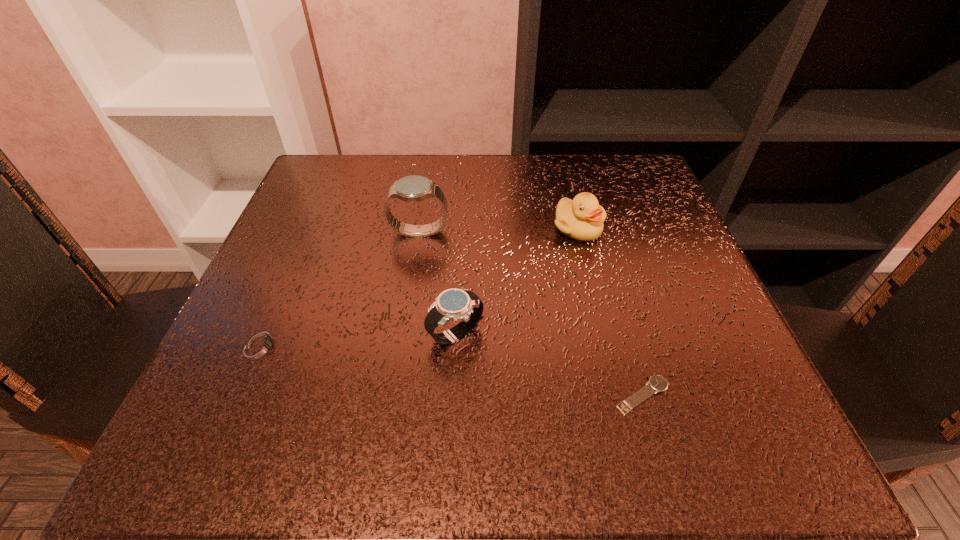
Locate an element on the screen. vacant space that's between the third shortest watch and the nearest object is located at coordinates (549, 364).

This screenshot has width=960, height=540. In order to click on free space between the second tallest watch and the duckling in this screenshot , I will do `click(516, 281)`.

The height and width of the screenshot is (540, 960). What are the coordinates of `vacant space in between the second tallest watch and the duckling` in the screenshot? It's located at (516, 281).

Identify the location of empty location between the shortest object and the second shortest object. (452, 370).

I want to click on free space that is in between the nearest watch and the leftmost watch, so click(452, 370).

This screenshot has height=540, width=960. What are the coordinates of `vacant space that is in between the shortest watch and the third shortest watch` in the screenshot? It's located at pos(549,364).

The width and height of the screenshot is (960, 540). What are the coordinates of `free space between the nearest object and the second shortest object` in the screenshot? It's located at (452, 370).

Choose which object is the second nearest neighbor to the leftmost watch. Please provide its 2D coordinates. Your answer should be formatted as a tuple, i.e. [(x, y)], where the tuple contains the x and y coordinates of a point satisfying the conditions above.

[(414, 188)]

Locate an element on the screen. the fourth closest object to the duckling is located at coordinates (262, 345).

What are the coordinates of `the second closest watch relative to the duckling` in the screenshot? It's located at (462, 305).